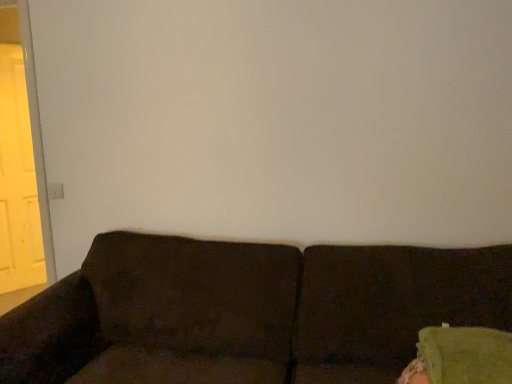
Question: Considering their positions, is dark brown fabric couch at lower center located in front of or behind yellow matte door at left?

Choices:
 (A) front
 (B) behind

Answer: (A)

Question: Is point (409, 297) positioned closer to the camera than point (2, 57)?

Choices:
 (A) closer
 (B) farther

Answer: (A)

Question: Is dark brown fabric couch at lower center bigger or smaller than yellow matte door at left?

Choices:
 (A) small
 (B) big

Answer: (B)

Question: From a real-world perspective, relative to dark brown fabric couch at lower center, is yellow matte door at left vertically above or below?

Choices:
 (A) below
 (B) above

Answer: (B)

Question: Would you say yellow matte door at left is inside or outside dark brown fabric couch at lower center?

Choices:
 (A) inside
 (B) outside

Answer: (B)

Question: Considering the positions of point (25, 200) and point (346, 354), is point (25, 200) closer or farther from the camera than point (346, 354)?

Choices:
 (A) farther
 (B) closer

Answer: (A)

Question: Is yellow matte door at left in front of or behind dark brown fabric couch at lower center in the image?

Choices:
 (A) behind
 (B) front

Answer: (A)